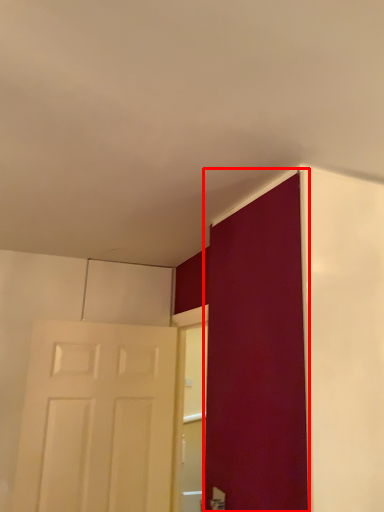
Question: From the image's perspective, what is the correct spatial relationship of door (annotated by the red box) in relation to door?

Choices:
 (A) above
 (B) below

Answer: (A)